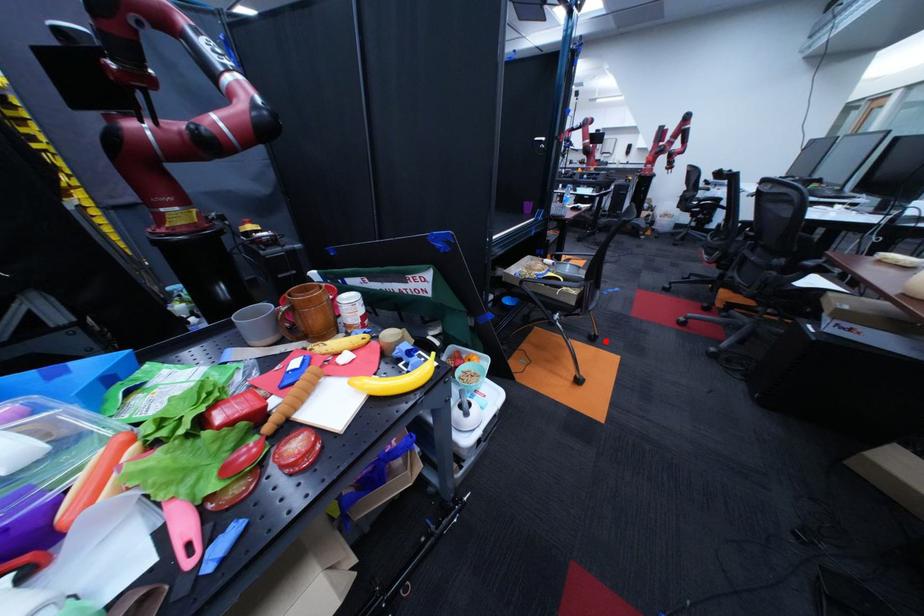
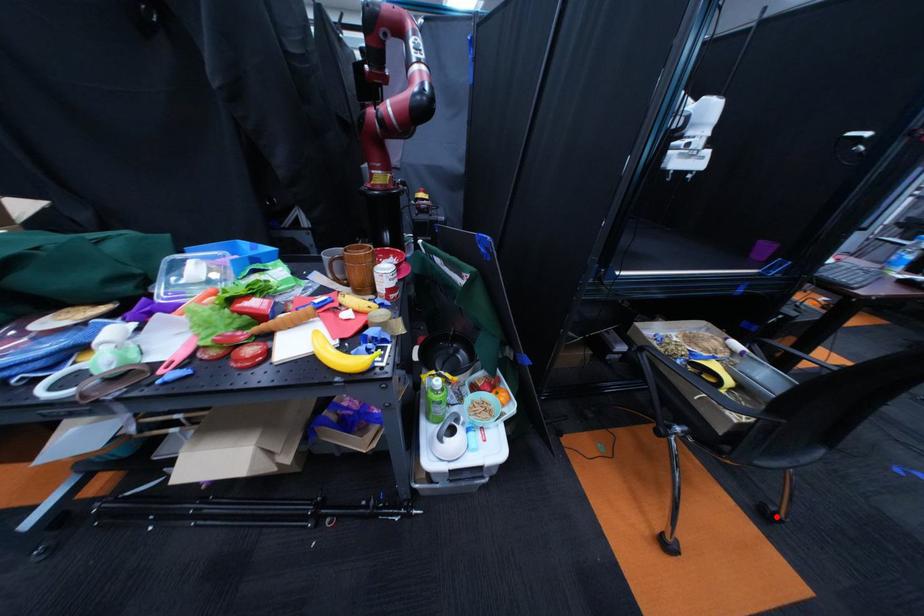
I am providing you with two images of the same scene from different viewpoints. A red point is marked on the first image and another point is marked on the second image. Does the point marked in image1 correspond to the same location as the one in image2?

Yes